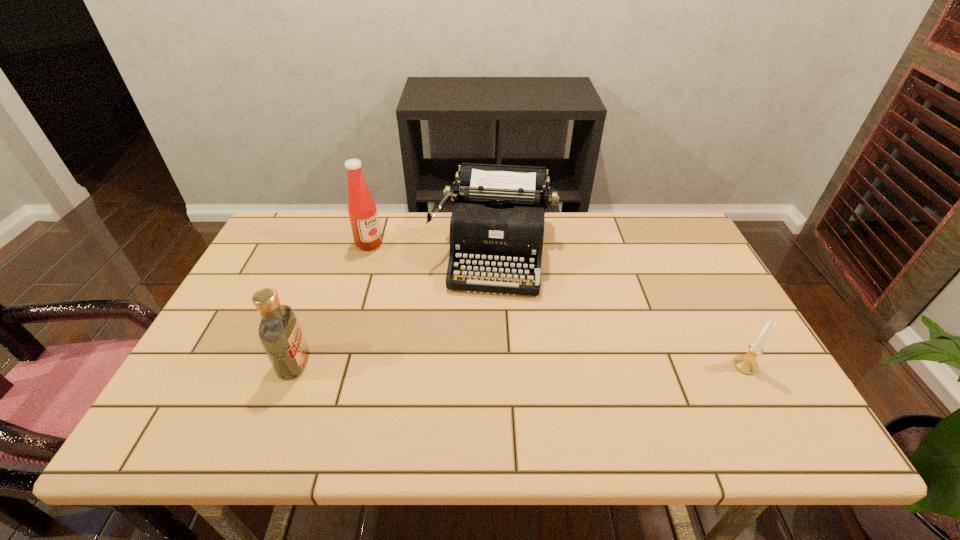
Find the location of `vodka`. vodka is located at coordinates (279, 332).

In order to click on the rightmost object in this screenshot , I will do `click(746, 364)`.

Locate an element on the screen. The image size is (960, 540). candle holder is located at coordinates (746, 364).

Identify the location of typewriter. This screenshot has height=540, width=960. (497, 223).

The height and width of the screenshot is (540, 960). In order to click on the third object from right to left in this screenshot , I will do [362, 211].

Find the location of a particular element. This screenshot has height=540, width=960. condiment is located at coordinates (362, 211).

Locate an element on the screen. This screenshot has height=540, width=960. vacant space located 0.350m on the front-facing side of the vodka is located at coordinates (456, 363).

The width and height of the screenshot is (960, 540). Find the location of `vacant region located on the back of the shortest object`. vacant region located on the back of the shortest object is located at coordinates (711, 303).

The width and height of the screenshot is (960, 540). I want to click on vacant region located 0.180m on the typing side of the typewriter, so click(481, 350).

The image size is (960, 540). In order to click on free region located on the typing side of the typewriter in this screenshot , I will do `click(483, 338)`.